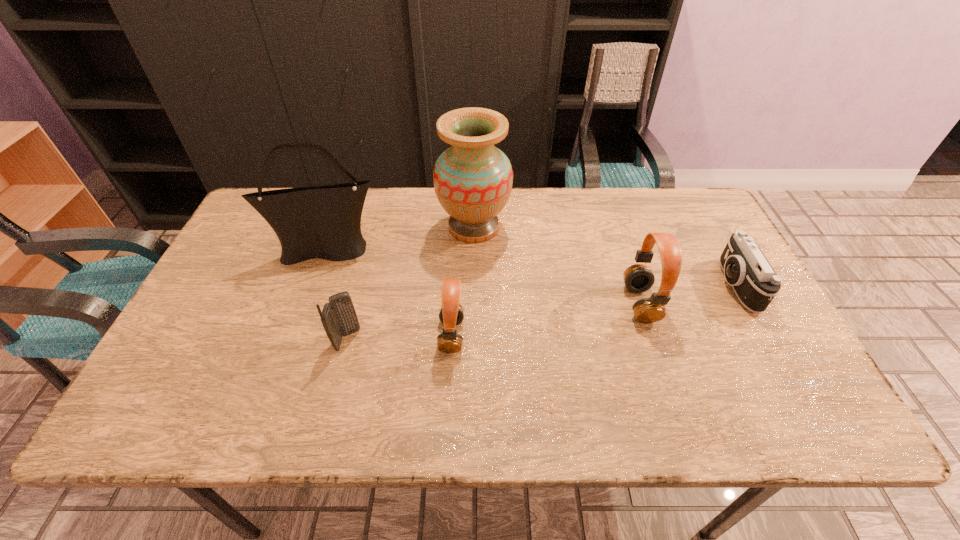
I want to click on the left headset, so click(x=451, y=314).

Where is `the right headset`? Image resolution: width=960 pixels, height=540 pixels. the right headset is located at coordinates (638, 278).

You are a GUI agent. You are given a task and a screenshot of the screen. Output one action in this format:
    pyautogui.click(x=<x>, y=<y>)
    Task: Click on the taller headset
    Image resolution: width=960 pixels, height=540 pixels.
    Given the screenshot: What is the action you would take?
    pyautogui.click(x=638, y=278)

You are a GUI agent. You are given a task and a screenshot of the screen. Output one action in this format:
    pyautogui.click(x=<x>, y=<y>)
    Task: Click on the vase
    This screenshot has height=540, width=960.
    Given the screenshot: What is the action you would take?
    pyautogui.click(x=473, y=179)

Identify the location of shoulder bag. Image resolution: width=960 pixels, height=540 pixels. (324, 222).

The width and height of the screenshot is (960, 540). What are the coordinates of `the shortest object` in the screenshot? It's located at (755, 283).

The image size is (960, 540). In order to click on camera in this screenshot , I will do `click(755, 283)`.

Identify the location of cellular telephone. The image size is (960, 540). click(338, 317).

This screenshot has height=540, width=960. Identify the location of free region located 0.300m on the ear cups of the left headset. (315, 335).

Locate an element on the screen. Image resolution: width=960 pixels, height=540 pixels. free space located 0.280m on the ear cups of the left headset is located at coordinates (323, 335).